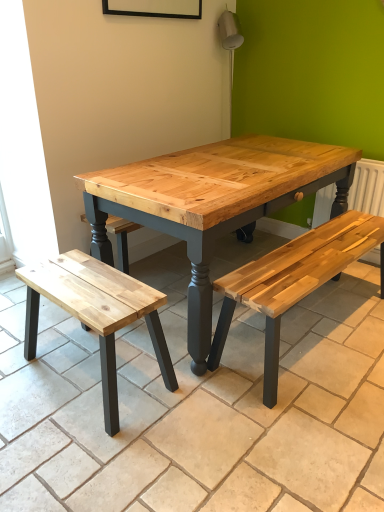
Locate an element on the screen. vacant space situated above natural wood bench at lower right (from a real-world perspective) is located at coordinates (175, 350).